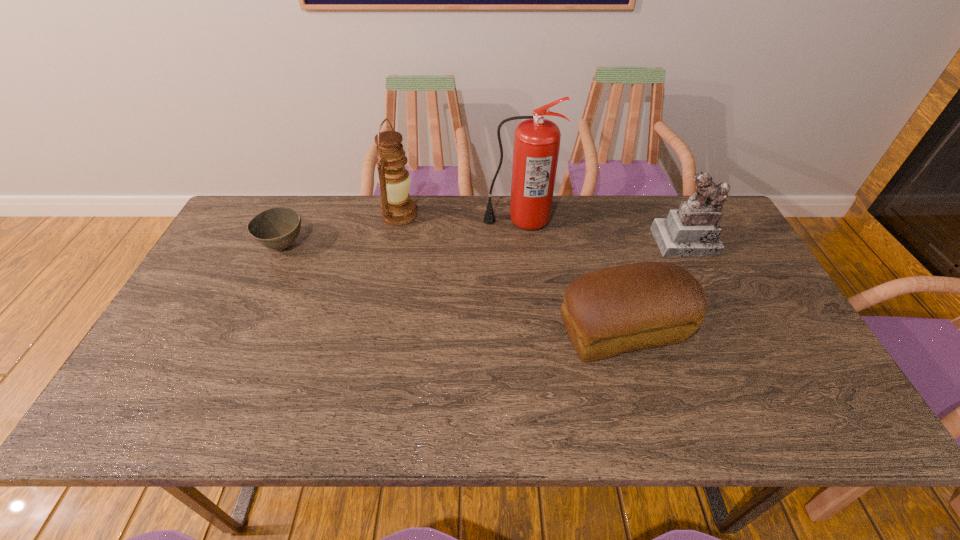
I want to click on the tallest object, so click(537, 140).

This screenshot has height=540, width=960. I want to click on oil lamp, so click(394, 180).

This screenshot has height=540, width=960. I want to click on the fourth object from right to left, so click(394, 180).

At what (x,y) coordinates should I click in order to perform the action: click on the third tallest object. Please return your answer as a coordinate pair (x, y). Looking at the image, I should click on (691, 231).

Locate an element on the screen. This screenshot has height=540, width=960. the rightmost object is located at coordinates (691, 231).

You are a GUI agent. You are given a task and a screenshot of the screen. Output one action in this format:
    pyautogui.click(x=<x>, y=<y>)
    Task: Click on the nearest object
    The image size is (960, 540).
    Given the screenshot: What is the action you would take?
    pyautogui.click(x=610, y=311)

Where is `the fourth tallest object`? The width and height of the screenshot is (960, 540). the fourth tallest object is located at coordinates (610, 311).

This screenshot has width=960, height=540. I want to click on bowl, so click(276, 228).

This screenshot has width=960, height=540. Find the location of `the shortest object`. the shortest object is located at coordinates (276, 228).

The width and height of the screenshot is (960, 540). I want to click on vacant area situated on the instruction side of the tallest object, so click(x=529, y=316).